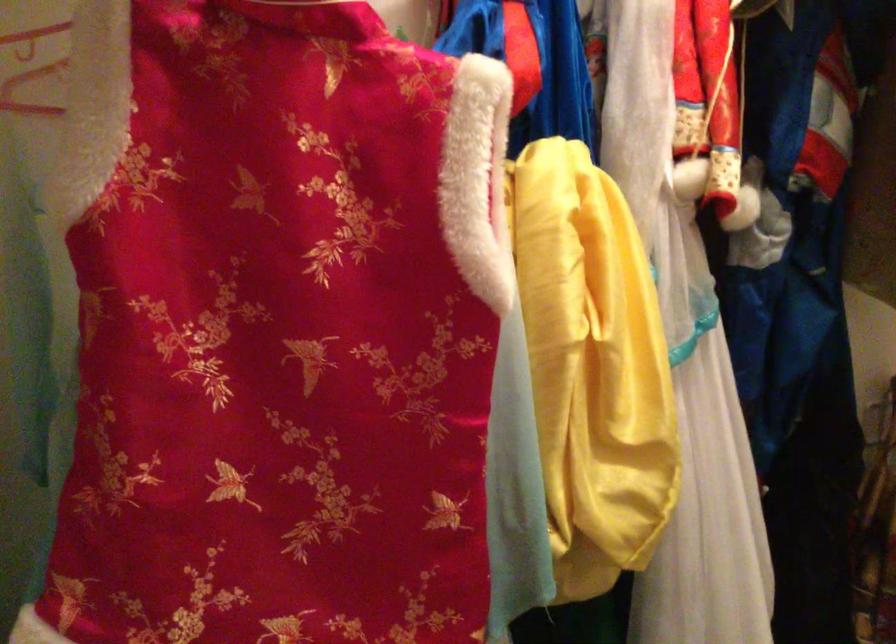
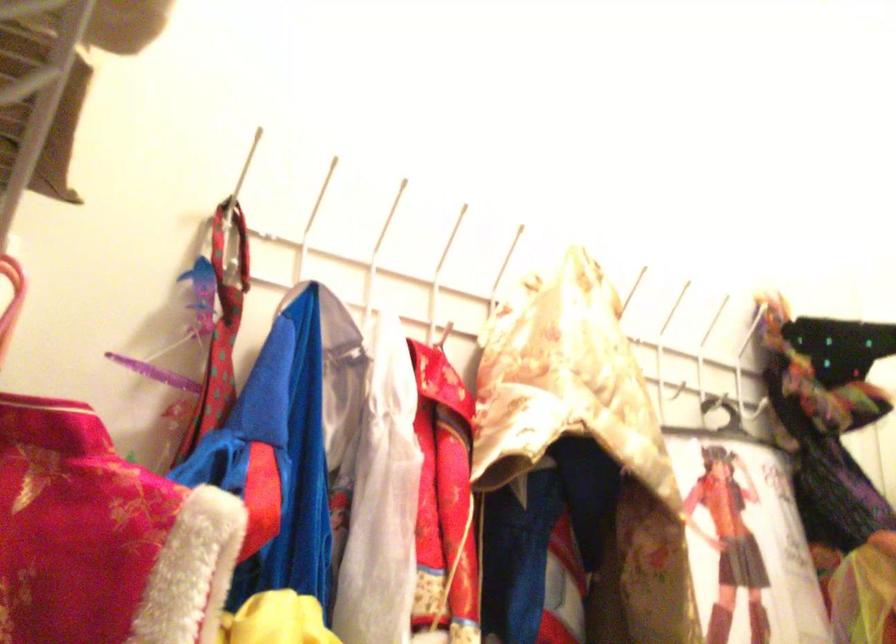
The first image is from the beginning of the video and the second image is from the end. How did the camera likely rotate when shooting the video?

The camera rotated toward right-up.